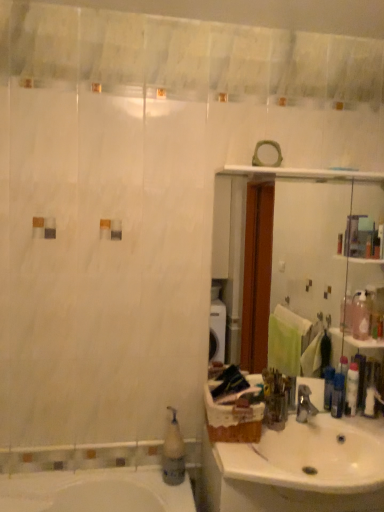
Locate an element on the screen. clear glass mirror at upper center is located at coordinates (303, 256).

The image size is (384, 512). Describe the element at coordinates (301, 468) in the screenshot. I see `white ceramic sink at lower right` at that location.

You are a GUI agent. You are given a task and a screenshot of the screen. Output one action in this format:
    pyautogui.click(x=<x>, y=<y>)
    Task: Click on the silver metallic faucet at sink right
    This screenshot has height=512, width=384.
    Given the screenshot: What is the action you would take?
    pyautogui.click(x=305, y=405)

In the scene shown: Looking at the image, does blue plastic bottle at sink seem bigger or smaller compared to clear glass mirror at upper center?

blue plastic bottle at sink is smaller than clear glass mirror at upper center.

From a real-world perspective, between blue plastic bottle at sink and clear glass mirror at upper center, who is vertically lower?

In real-world perspective, blue plastic bottle at sink is lower.

Measure the distance from blue plastic bottle at sink to clear glass mirror at upper center.

They are 79.35 centimeters apart.

Is blue plastic bottle at sink positioned before clear glass mirror at upper center?

No, blue plastic bottle at sink is behind clear glass mirror at upper center.

Is blue plastic bottle at sink further to the viewer compared to silver metallic faucet at sink right?

Yes, blue plastic bottle at sink is further from the camera.

Is blue plastic bottle at sink spatially inside silver metallic faucet at sink right, or outside of it?

blue plastic bottle at sink lies outside silver metallic faucet at sink right.

Which object is positioned more to the left, blue plastic bottle at sink or silver metallic faucet at sink right?

silver metallic faucet at sink right.

From a real-world perspective, relative to silver metallic faucet at sink right, is blue plastic bottle at sink vertically above or below?

In terms of real-world spatial position, blue plastic bottle at sink is above silver metallic faucet at sink right.

Is white plastic soap dispenser at lower left at the back of white ceramic sink at lower right?

white ceramic sink at lower right does not have its back to white plastic soap dispenser at lower left.

From a real-world perspective, between white ceramic sink at lower right and white plastic soap dispenser at lower left, who is vertically higher?

In real-world perspective, white plastic soap dispenser at lower left is above.

Does white ceramic sink at lower right lie behind white plastic soap dispenser at lower left?

No, white ceramic sink at lower right is in front of white plastic soap dispenser at lower left.

From the picture: Does white ceramic sink at lower right have a lesser height compared to white plastic soap dispenser at lower left?

Correct, white ceramic sink at lower right is not as tall as white plastic soap dispenser at lower left.

From the image's perspective, is clear glass mirror at upper center positioned above or below white ceramic sink at lower right?

Based on their image positions, clear glass mirror at upper center is located above white ceramic sink at lower right.

Considering the points (351, 234) and (367, 432), which point is behind, point (351, 234) or point (367, 432)?

The point (351, 234) is farther from the camera.

Does clear glass mirror at upper center have a greater width compared to white ceramic sink at lower right?

No.

From a real-world perspective, is clear glass mirror at upper center positioned above or below white ceramic sink at lower right?

clear glass mirror at upper center is above white ceramic sink at lower right.

From the image's perspective, is clear glass mirror at upper center below blue plastic bottle at sink?

Actually, clear glass mirror at upper center appears above blue plastic bottle at sink in the image.

Could you tell me if clear glass mirror at upper center is turned towards blue plastic bottle at sink?

Yes, clear glass mirror at upper center faces towards blue plastic bottle at sink.

Between clear glass mirror at upper center and blue plastic bottle at sink, which one has smaller width?

clear glass mirror at upper center is thinner.

Between white plastic soap dispenser at lower left and white ceramic sink at lower right, which one appears on the left side from the viewer's perspective?

white plastic soap dispenser at lower left is more to the left.

From the image's perspective, which one is positioned higher, white plastic soap dispenser at lower left or white ceramic sink at lower right?

white plastic soap dispenser at lower left.

Is point (381, 428) closer to camera compared to point (306, 413)?

Yes, point (381, 428) is in front of point (306, 413).

Is white ceramic sink at lower right taller than silver metallic faucet at sink right?

Yes.

Could you tell me if white ceramic sink at lower right is facing silver metallic faucet at sink right?

No, white ceramic sink at lower right is not turned towards silver metallic faucet at sink right.

The image size is (384, 512). I want to click on mirror on the left of blue plastic bottle at sink, so click(x=303, y=256).

Image resolution: width=384 pixels, height=512 pixels. In the image, there is a blue plastic bottle at sink. Identify the location of tap below it (from a real-world perspective). (305, 405).

From the image, which object appears to be farther from silver metallic faucet at sink right, blue plastic bottle at sink or clear glass mirror at upper center?

Based on the image, clear glass mirror at upper center appears to be further to silver metallic faucet at sink right.

Consider the image. Based on their spatial positions, is white ceramic sink at lower right or clear glass mirror at upper center further from silver metallic faucet at sink right?

The object further to silver metallic faucet at sink right is clear glass mirror at upper center.

Based on their spatial positions, is white plastic soap dispenser at lower left or blue plastic bottle at sink further from white ceramic sink at lower right?

white plastic soap dispenser at lower left lies further to white ceramic sink at lower right than the other object.

Which object lies further to the anchor point clear glass mirror at upper center, white ceramic sink at lower right or blue plastic bottle at sink?

The object further to clear glass mirror at upper center is blue plastic bottle at sink.

Looking at this image, which object lies further to the anchor point silver metallic faucet at sink right, blue plastic bottle at sink or white plastic soap dispenser at lower left?

The object further to silver metallic faucet at sink right is white plastic soap dispenser at lower left.

Considering their positions, is blue plastic bottle at sink positioned closer to white plastic soap dispenser at lower left than silver metallic faucet at sink right?

silver metallic faucet at sink right lies closer to white plastic soap dispenser at lower left than the other object.

Looking at the image, which one is located closer to silver metallic faucet at sink right, white plastic soap dispenser at lower left or white ceramic sink at lower right?

Based on the image, white ceramic sink at lower right appears to be nearer to silver metallic faucet at sink right.

Which object lies nearer to the anchor point silver metallic faucet at sink right, clear glass mirror at upper center or white ceramic sink at lower right?

The object closer to silver metallic faucet at sink right is white ceramic sink at lower right.

This screenshot has height=512, width=384. What are the coordinates of `soap dispenser between clear glass mirror at upper center and white ceramic sink at lower right in the vertical direction` in the screenshot? It's located at (173, 453).

You are a GUI agent. You are given a task and a screenshot of the screen. Output one action in this format:
    pyautogui.click(x=<x>, y=<y>)
    Task: Click on the mirror situated between white plastic soap dispenser at lower left and blue plastic bottle at sink from left to right
    This screenshot has width=384, height=512.
    Given the screenshot: What is the action you would take?
    pyautogui.click(x=303, y=256)

Locate an element on the screen. The image size is (384, 512). tap situated between white plastic soap dispenser at lower left and blue plastic bottle at sink from left to right is located at coordinates (305, 405).

The width and height of the screenshot is (384, 512). In order to click on sink between white plastic soap dispenser at lower left and silver metallic faucet at sink right in this screenshot , I will do `click(301, 468)`.